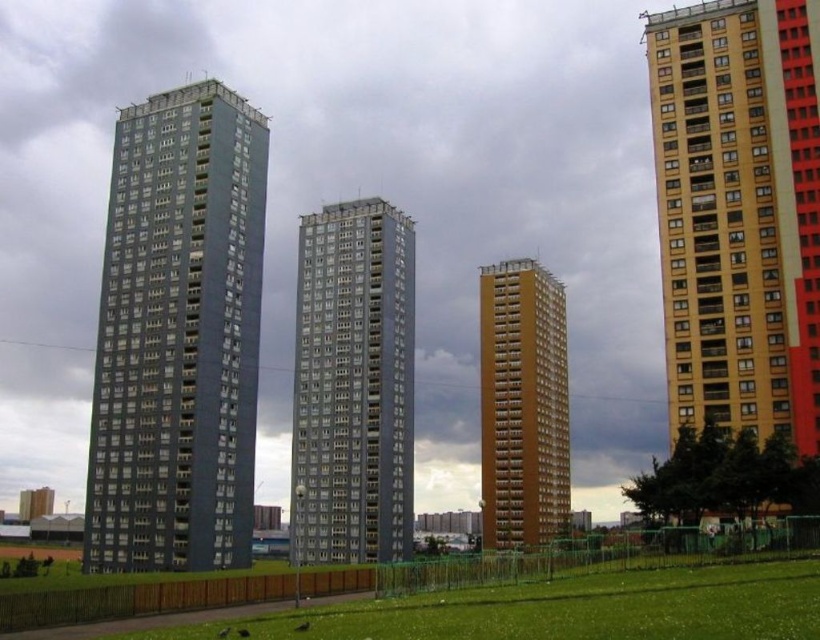
Does matte gray building at left come behind gray concrete building at center?

That is False.

Describe the element at coordinates (178, 337) in the screenshot. This screenshot has width=820, height=640. I see `matte gray building at left` at that location.

Locate an element on the screen. matte gray building at left is located at coordinates (178, 337).

Is the position of gray concrete building at center less distant than that of brown matte building at center?

Yes, gray concrete building at center is in front of brown matte building at center.

Which is more to the right, gray concrete building at center or brown matte building at center?

brown matte building at center is more to the right.

Describe the element at coordinates (353, 385) in the screenshot. I see `gray concrete building at center` at that location.

You are a GUI agent. You are given a task and a screenshot of the screen. Output one action in this format:
    pyautogui.click(x=<x>, y=<y>)
    Task: Click on the gray concrete building at center
    The height and width of the screenshot is (640, 820).
    Given the screenshot: What is the action you would take?
    pyautogui.click(x=353, y=385)

The image size is (820, 640). What do you see at coordinates (178, 337) in the screenshot? I see `matte gray building at left` at bounding box center [178, 337].

Is the position of matte gray building at left less distant than that of brown matte building at center?

Yes, it is.

Is point (194, 314) farther from camera compared to point (516, 531)?

No, it is not.

The height and width of the screenshot is (640, 820). Identify the location of matte gray building at left. (178, 337).